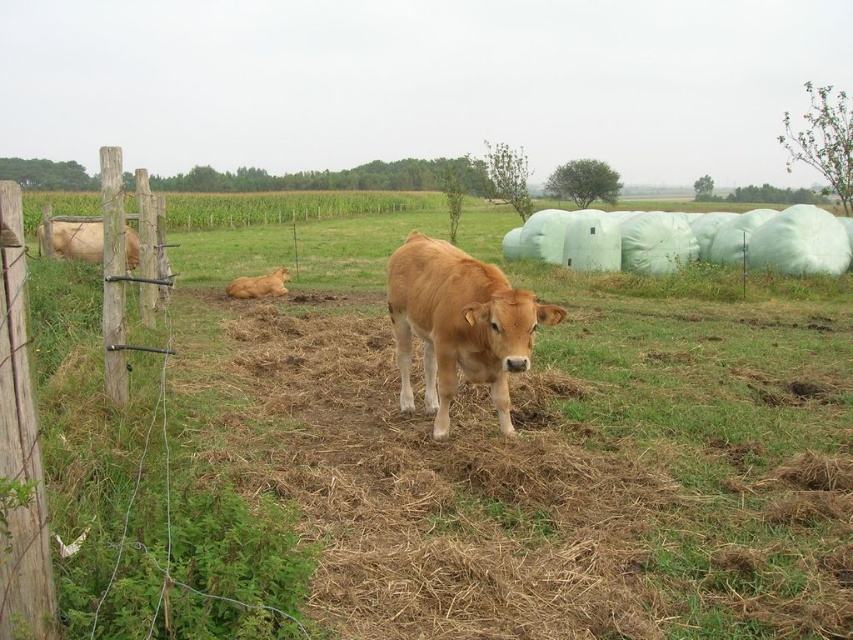
You are standing in the middle of the field and see the brown grass at center and the brown wooden post at left. Which object is located to the east of the other?

The brown grass at center is to the east of the brown wooden post at left because it is positioned to the right of it.

You are standing at the point marked as point (502, 464) in the image. What type of ground are you currently standing on?

You are standing on brown grass at center as the point (502, 464) is on brown grass at center.

You are a farmer checking the calves in the field. You see the golden smooth calf at center and the brown furry calf at lower left. Which calf is positioned lower in the image?

The golden smooth calf at center is located below the brown furry calf at lower left, so it is positioned lower in the image.